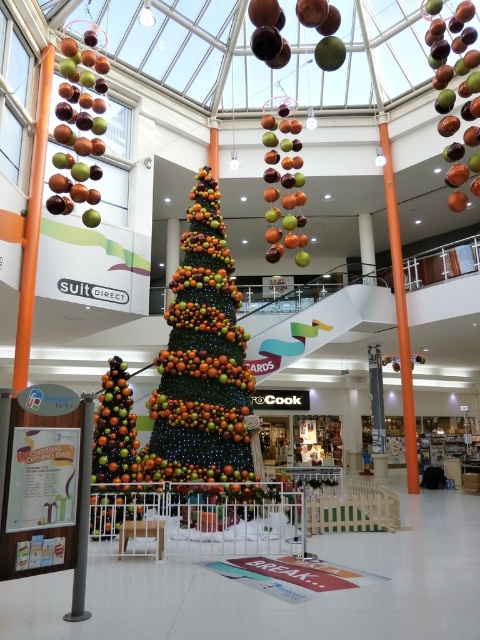
Question: Can you confirm if multicolored fabric christmas tree at center is thinner than shiny metallic ornaments at left?

Choices:
 (A) no
 (B) yes

Answer: (A)

Question: Does shiny metallic ornaments at upper center have a larger size compared to shiny metallic ornaments at center?

Choices:
 (A) yes
 (B) no

Answer: (A)

Question: Does multicolored fabric christmas tree at center have a smaller size compared to shiny metallic ornaments at upper center?

Choices:
 (A) no
 (B) yes

Answer: (A)

Question: Which object appears farthest from the camera in this image?

Choices:
 (A) shiny metallic apple at center
 (B) shiny metallic ornaments at left

Answer: (A)

Question: Which of the following is the closest to the observer?

Choices:
 (A) shiny metallic ornaments at upper center
 (B) multicolored fabric christmas tree at center

Answer: (B)

Question: Which object is positioned closest to the shiny metallic ornaments at left?

Choices:
 (A) shiny metallic ornaments at center
 (B) shiny metallic ornaments at upper center
 (C) shiny metallic apple at center

Answer: (B)